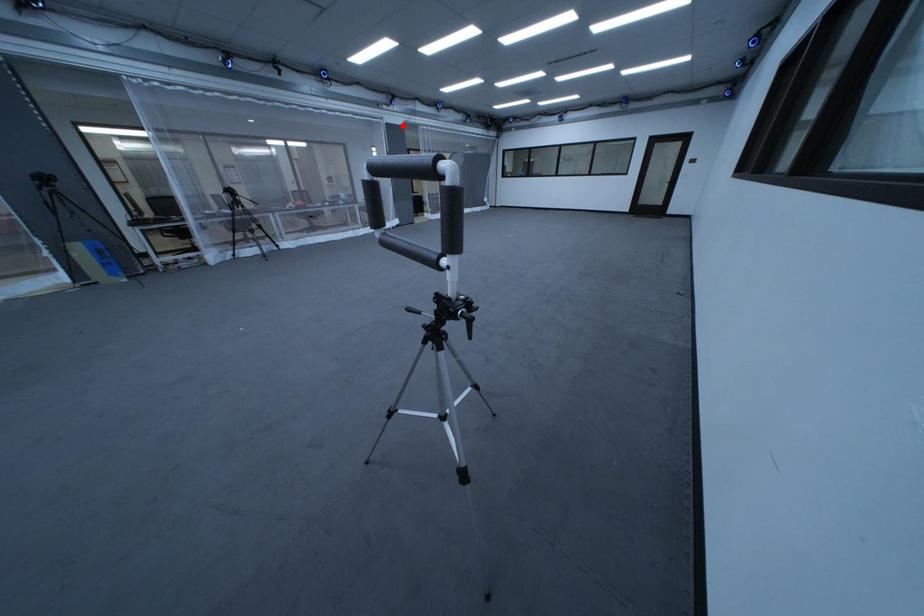
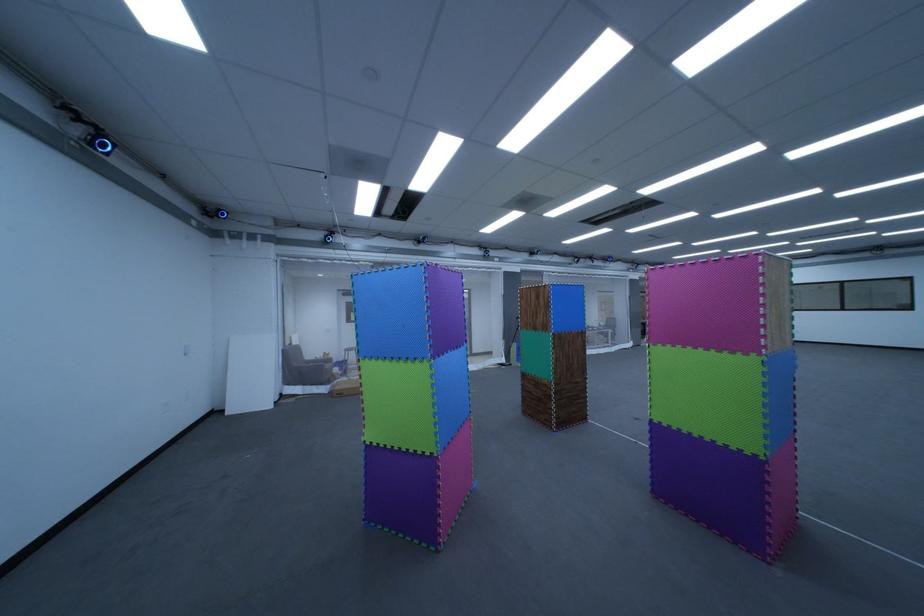
In the second image, find the point that corresponds to the highlighted location in the first image.

(647, 281)